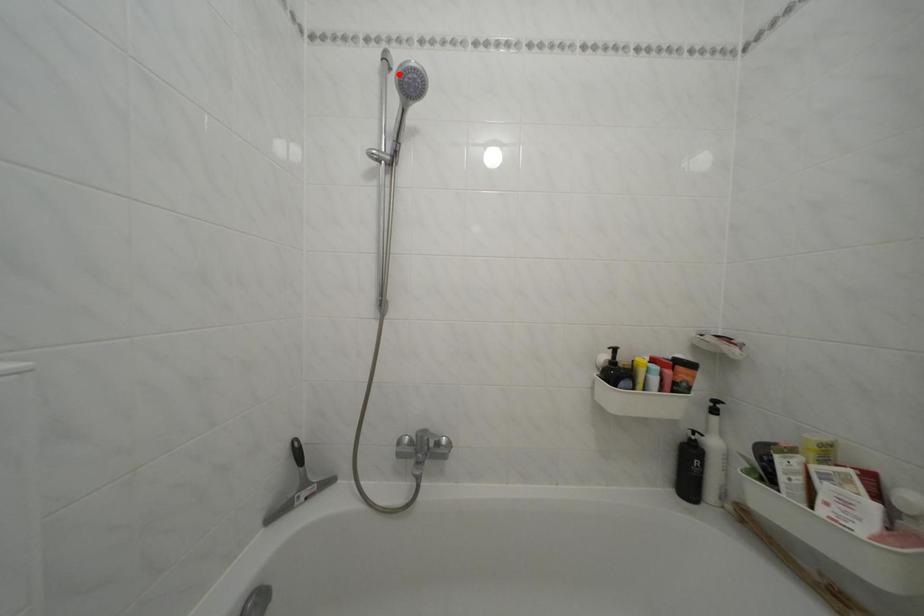
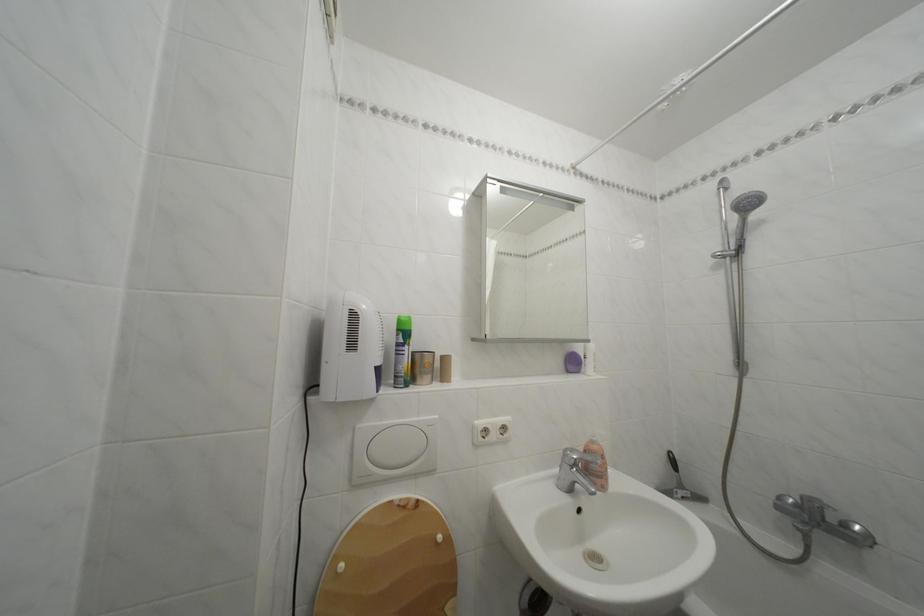
The point at the highlighted location is marked in the first image. Where is the corresponding point in the second image?

(736, 195)